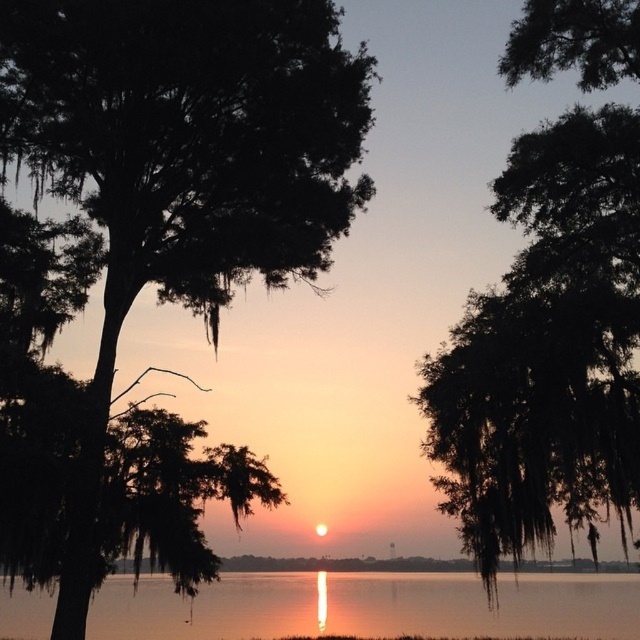
You are an artist setting up your easel to paint the sunset scene. You want to capture both the silhouette tree at left and the green mossy tree at upper right in your painting. Based on their widths, which tree should you give more space to on the canvas?

The silhouette tree at left might be wider than green mossy tree at upper right, so you should give more space to the silhouette tree at left on the canvas to accurately represent its width.

You are standing in the sunset scene and want to take a photo. You notice two points in the frame labeled as point (45, 131) and point (461, 356). Which point is closer to your camera?

Point (45, 131) is further to the camera than point (461, 356). Therefore, point (461, 356) is closer to the camera.

You are standing at the center of the image and want to walk towards the silhouette tree at left and the green mossy tree at upper right. Which direction should you face first to reach both trees without crossing paths?

You should face left first to reach the silhouette tree at left, as it is to the left of the green mossy tree at upper right. After reaching it, you can then turn towards the upper right direction to reach the other tree without crossing paths.